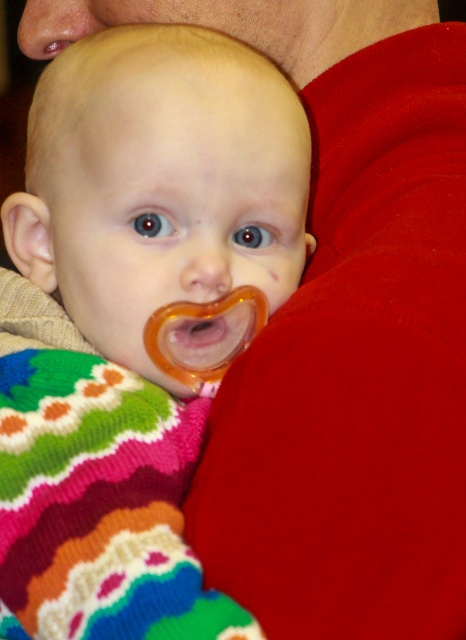
You are a photographer trying to focus on the pacifier in the baby being held by the adult. You notice two points in the image labeled as point (111,538) and point (199,275). Which point is closer to the camera?

Point (111,538) is in front of point (199,275), so it is closer to the camera.

You are a photographer taking a close up shot of a baby and an adult. You notice two noses in the frame. Which nose is closer to the camera between the smooth skin nose at upper left and the smooth flesh nose at center?

The smooth skin nose at upper left is closer to the camera because the smooth flesh nose at center is behind it.

You are a photographer taking a close up portrait of a baby. You notice a small detail called smooth skin nose at upper left. Where exactly is this located in the image?

The smooth skin nose at upper left is located at point coordinates of (54, 26).